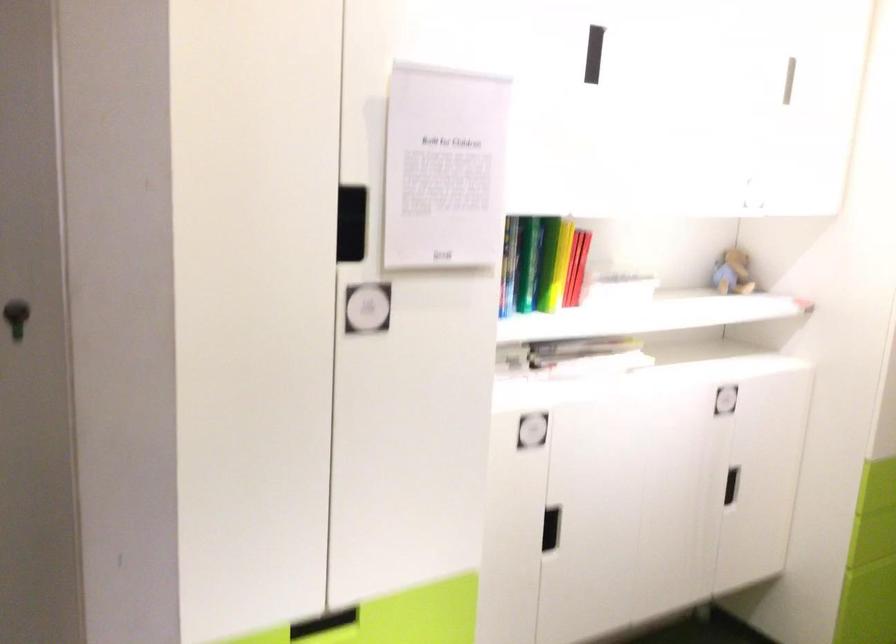
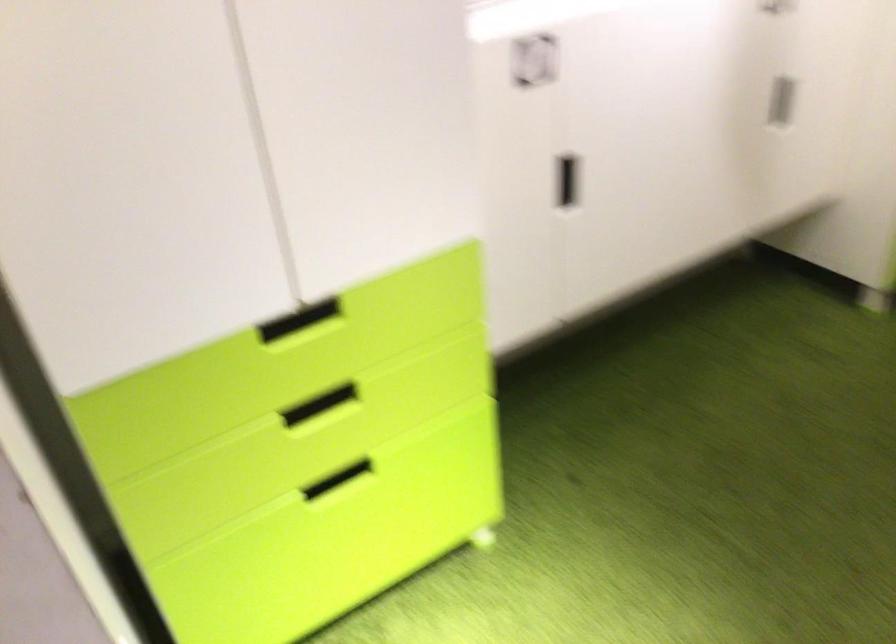
Question: The images are taken continuously from a first-person perspective. In which direction is your viewpoint rotating?

Choices:
 (A) Left
 (B) Right
 (C) Up
 (D) Down

Answer: (D)